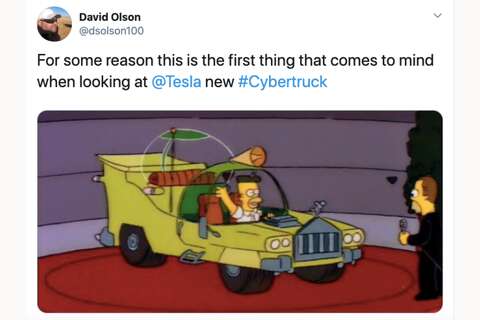
The image size is (480, 320). Identify the location of wall. (356, 153).